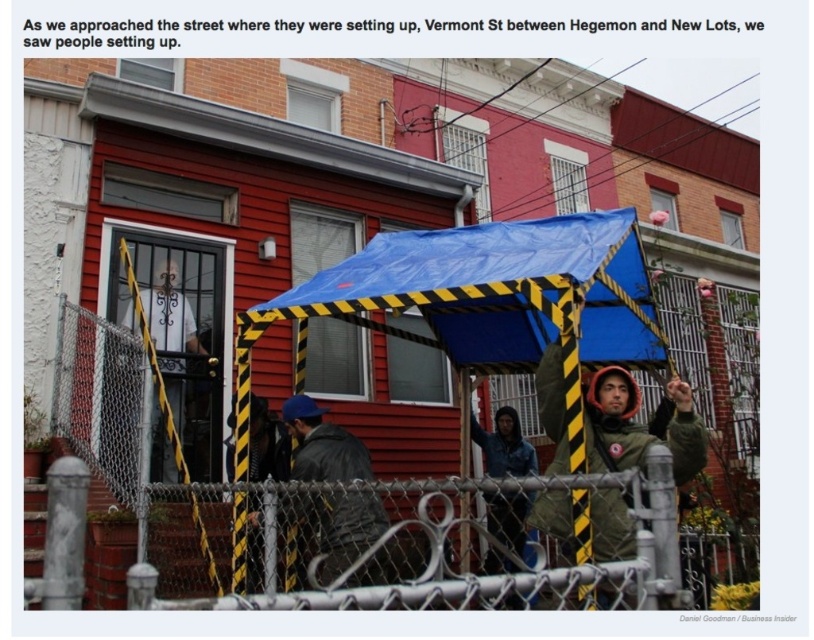
You are a delivery person trying to navigate through the area. You need to deliver a package to the building behind the fence. The narrowest path between the dark gray jacket at center and the denim jacket at center is 5.19 feet. Can a standard delivery cart, which is 3.5 feet wide, pass through this path?

The narrowest path between the dark gray jacket at center and the denim jacket at center is 5.19 feet. Since the delivery cart is 3.5 feet wide, it can pass through the path as the width is sufficient.